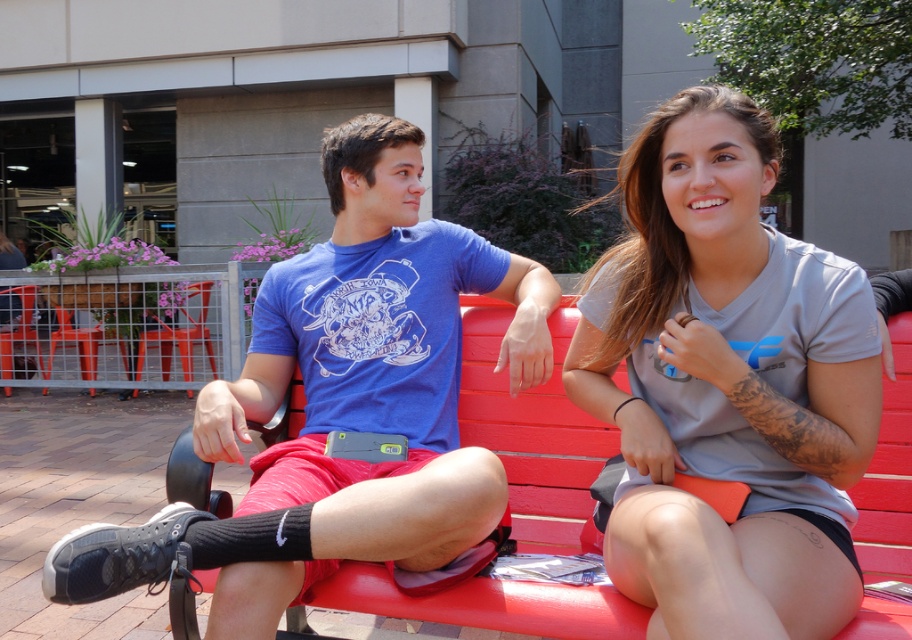
Does matte blue t-shirt at center have a larger size compared to red wood bench at center?

Correct, matte blue t-shirt at center is larger in size than red wood bench at center.

Which is above, matte blue t-shirt at center or red wood bench at center?

matte blue t-shirt at center

Is point (532, 332) farther from viewer compared to point (898, 532)?

Yes.

Where is `matte blue t-shirt at center`? Image resolution: width=912 pixels, height=640 pixels. matte blue t-shirt at center is located at coordinates (342, 403).

Is gray matte t-shirt at center positioned behind red wood bench at center?

No, gray matte t-shirt at center is closer to the viewer.

Consider the image. Is gray matte t-shirt at center wider than red wood bench at center?

Correct, the width of gray matte t-shirt at center exceeds that of red wood bench at center.

Does point (846, 312) lie behind point (333, 589)?

No, it is not.

In order to click on gray matte t-shirt at center in this screenshot , I will do `click(726, 385)`.

Between point (689, 150) and point (472, 269), which one is positioned in front?

Point (689, 150) is in front.

Which is below, gray matte t-shirt at center or matte blue t-shirt at center?

matte blue t-shirt at center

Where is `gray matte t-shirt at center`? Image resolution: width=912 pixels, height=640 pixels. gray matte t-shirt at center is located at coordinates (726, 385).

Where is `gray matte t-shirt at center`? The height and width of the screenshot is (640, 912). gray matte t-shirt at center is located at coordinates (726, 385).